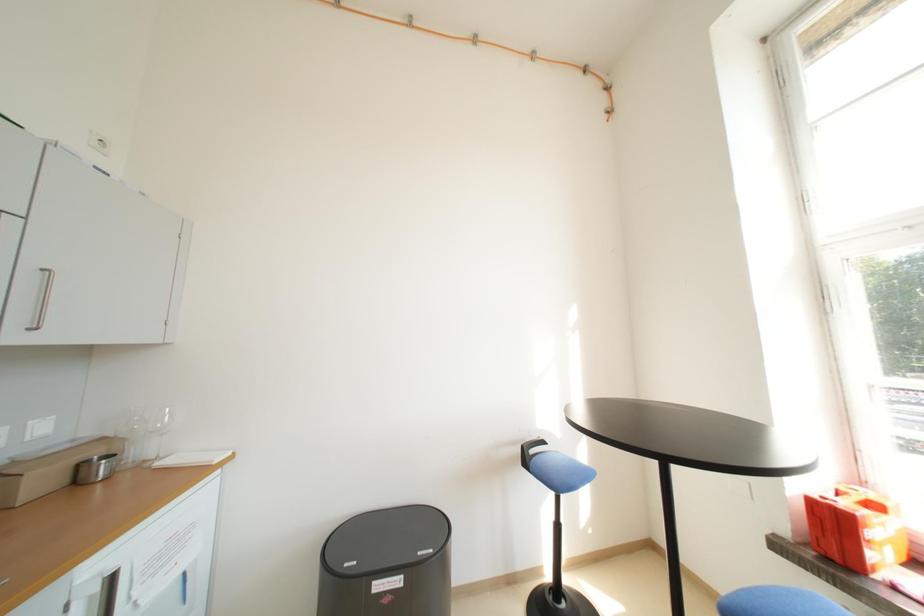
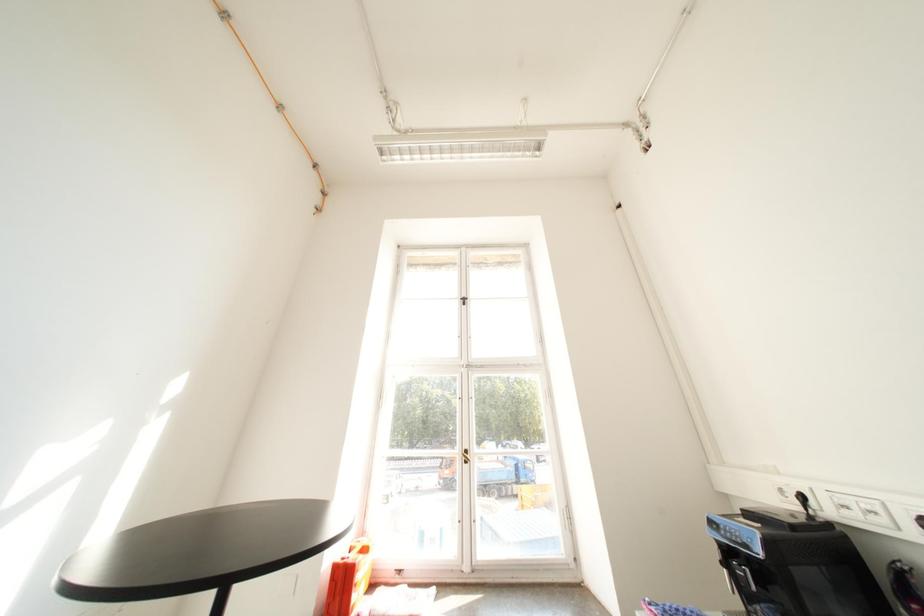
The images are taken continuously from a first-person perspective. In which direction is your viewpoint rotating?

The camera's rotation is toward right-up.